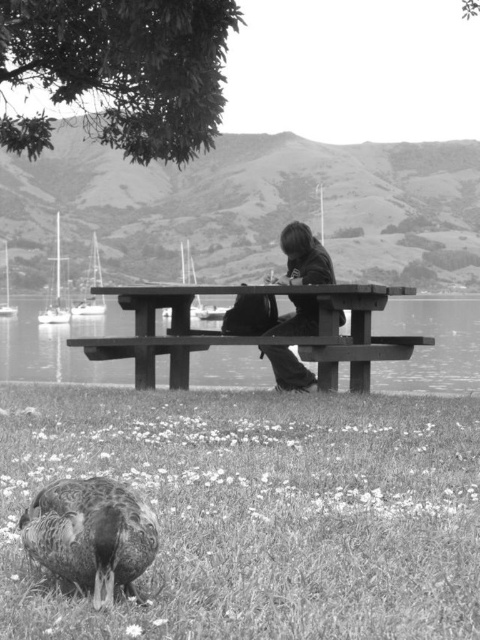
You are standing at the lakeside and want to estimate how far the wooden picnic table at center is from you. Based on the scene, can you determine the distance?

The wooden picnic table at center is 9.96 meters away from the camera, so the distance from you to the wooden picnic table at center is approximately 9.96 meters.

You are standing at the lakeside and want to take a photo of both the dark brown textured duck at lower left and the dark brown leather jacket at center. Which object should you focus on first to ensure both are in sharp focus?

You should focus on the dark brown textured duck at lower left first because it is closer to you than the dark brown leather jacket at center. By focusing on the closer object, the farther one may still be in focus depending on the depth of field.

You are a photographer trying to capture the duck and the person in the same frame. Given that the dark brown textured duck at lower left is smaller than the dark brown leather jacket at center, will the duck be fully visible in the photo if you focus on the person?

The dark brown textured duck at lower left has a lesser height compared to the dark brown leather jacket at center, so if you focus on the person, the duck might still be fully visible as it is smaller in size and positioned lower left in the frame.